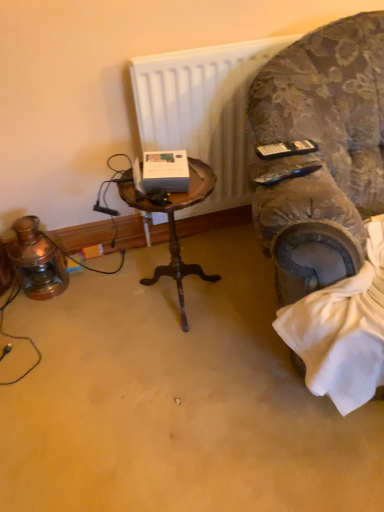
Find the location of a particular element. The height and width of the screenshot is (512, 384). free space between woodenobject at center and white matte radiator at upper center is located at coordinates (215, 262).